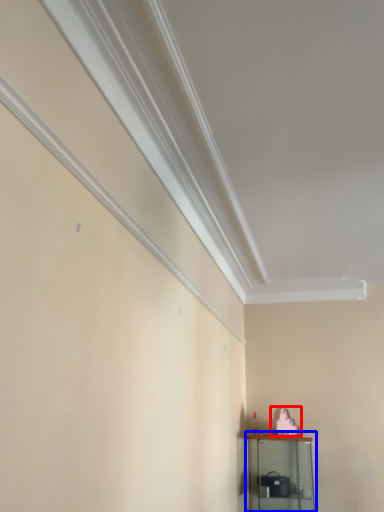
Question: Which point is closer to the camera, animal (highlighted by a red box) or shelf (highlighted by a blue box)?

Choices:
 (A) animal
 (B) shelf

Answer: (B)